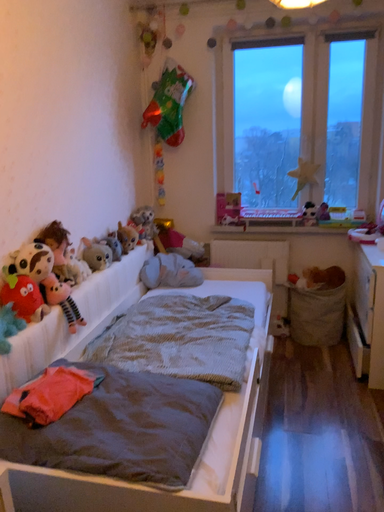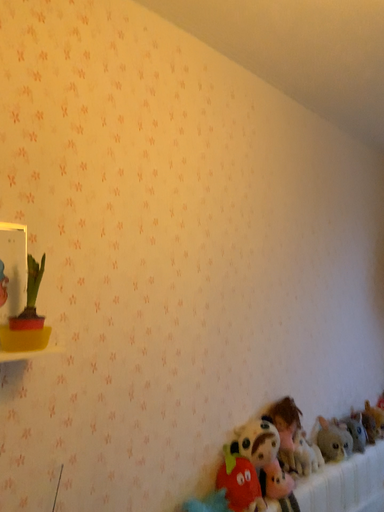
Question: How did the camera likely rotate when shooting the video?

Choices:
 (A) rotated upward
 (B) rotated downward

Answer: (A)